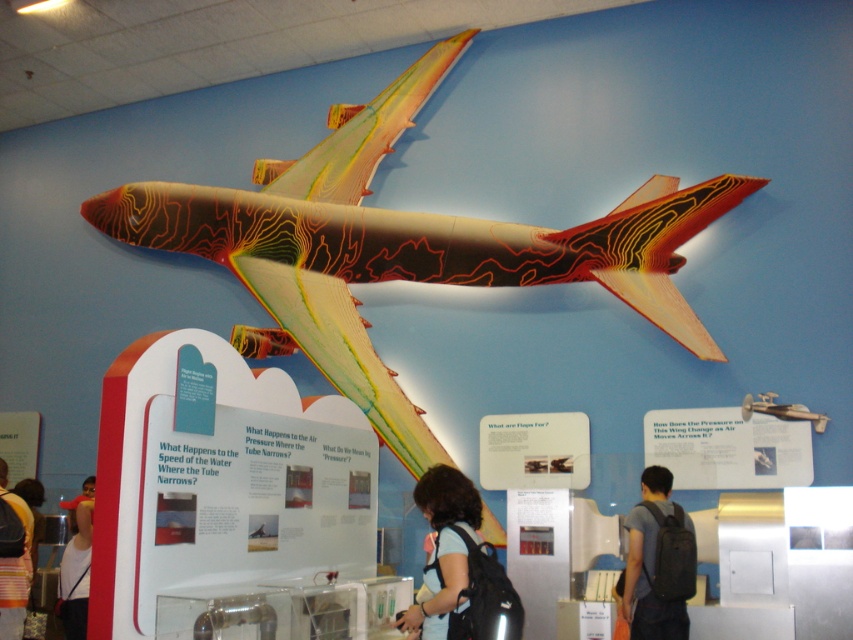
You are a visitor at the exhibit and want to check both the black backpack at lower right and the striped backpack at lower left for your belongings. Which backpack should you check first if you want to start from the left side of the display area?

You should check the striped backpack at lower left first because it is on the left side of the black backpack at lower right.

You are a visitor at the exhibit and want to touch the dark brown hair at center located at point [444,547]. However, there is a 1.2 meter wide barrier between you and the point. Can you reach the hair without moving past the barrier?

The dark brown hair at center is located at point [444,547]. Since there is a 1.2 meter wide barrier between you and the point, you cannot reach the hair without moving past the barrier because the barrier is wider than your arm span.

You are standing in front of the educational exhibit and see the black backpack at lower right and the striped backpack at lower left. You need to reach both backpacks to retrieve your items. Which backpack will you reach first if you start moving towards them from your current position?

The striped backpack at lower left will be reached first because it is closer to you than the black backpack at lower right, which is 3.20 meters away from it.